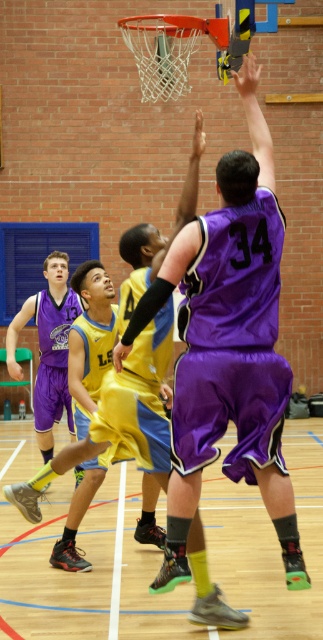
Question: Does purple fabric shorts at center lie behind purple satin jersey at center?

Choices:
 (A) yes
 (B) no

Answer: (B)

Question: Estimate the real-world distances between objects in this image. Which object is closer to the purple fabric shorts at center?

Choices:
 (A) purple satin jersey at center
 (B) matte purple shorts at left

Answer: (B)

Question: Considering the relative positions of matte purple shorts at left and purple satin jersey at center in the image provided, where is matte purple shorts at left located with respect to purple satin jersey at center?

Choices:
 (A) below
 (B) above

Answer: (B)

Question: Which of the following is the closest to the observer?

Choices:
 (A) (10, 349)
 (B) (235, 417)
 (C) (33, 403)

Answer: (B)

Question: Where is purple fabric shorts at center located in relation to matte purple shorts at left in the image?

Choices:
 (A) right
 (B) left

Answer: (A)

Question: Which object is farther from the camera taking this photo?

Choices:
 (A) purple satin jersey at center
 (B) purple fabric shorts at center
 (C) matte purple shorts at left

Answer: (A)